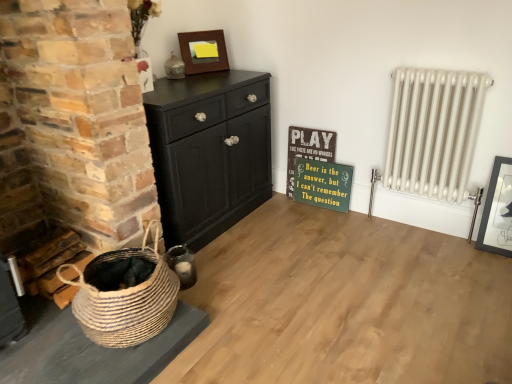
Identify the location of vacant area that lies between black painted wood chest of drawers at left and white metal radiator at right. (303, 232).